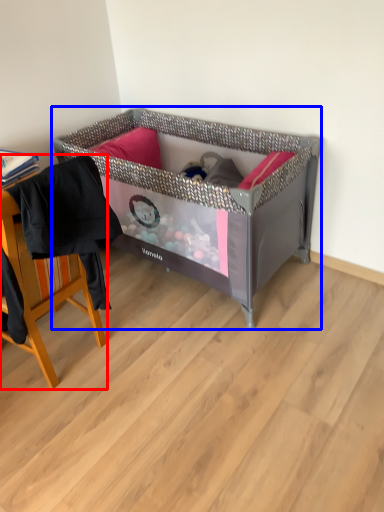
Question: Among these objects, which one is nearest to the camera, chair (highlighted by a red box) or infant bed (highlighted by a blue box)?

Choices:
 (A) chair
 (B) infant bed

Answer: (A)